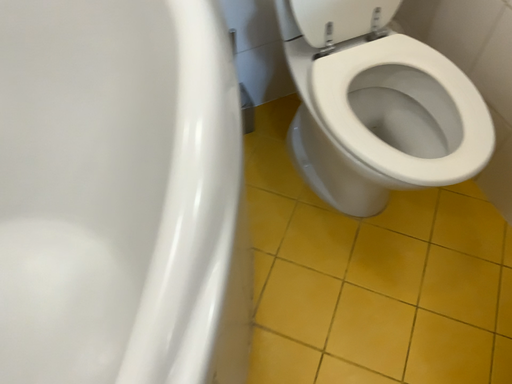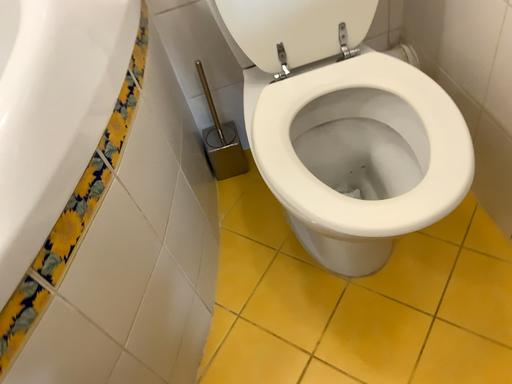
Question: Which way did the camera rotate in the video?

Choices:
 (A) rotated downward
 (B) rotated upward

Answer: (B)